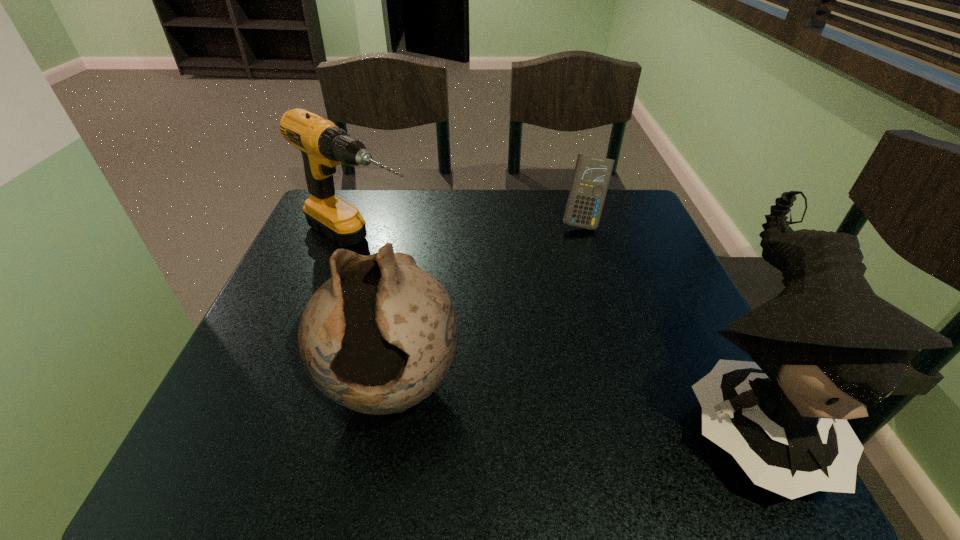
This screenshot has height=540, width=960. In order to click on free spot between the drill and the doll in this screenshot , I will do `click(553, 329)`.

This screenshot has height=540, width=960. What are the coordinates of `free space between the shortest object and the doll` in the screenshot? It's located at tap(664, 318).

This screenshot has width=960, height=540. Identify the location of object that is the nearest to the doll. (592, 174).

Identify the location of the third closest object to the drill. The width and height of the screenshot is (960, 540). (824, 349).